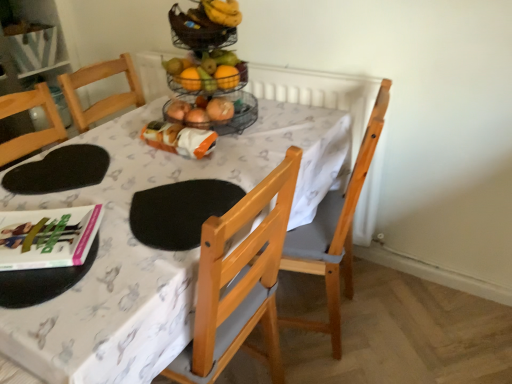
Locate an element on the screen. The image size is (512, 384). free space to the back side of black foam mat at upper left is located at coordinates (109, 134).